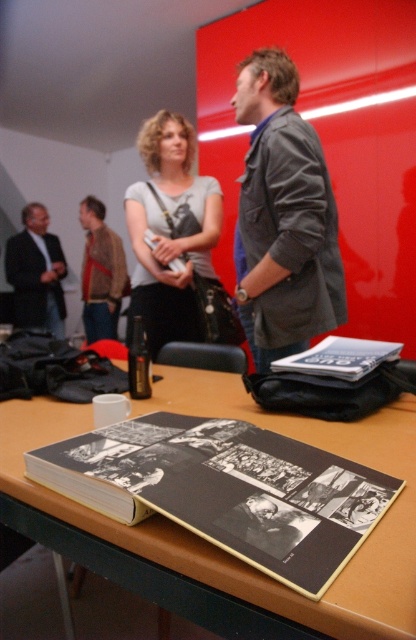
Question: Which point appears farthest from the camera in this image?

Choices:
 (A) (275, 308)
 (B) (401, 413)
 (C) (96, 337)
 (D) (24, 316)

Answer: (C)

Question: Is matte black suit at left positioned before brown leather jacket at left?

Choices:
 (A) no
 (B) yes

Answer: (A)

Question: Can you confirm if matte gray shirt at center is wider than black matte book at center?

Choices:
 (A) no
 (B) yes

Answer: (B)

Question: Estimate the real-world distances between objects in this image. Which object is closer to the brown wooden table at center?

Choices:
 (A) black matte book at center
 (B) dark gray textured jacket at center

Answer: (A)

Question: Where is matte black suit at left located in relation to black matte book at center in the image?

Choices:
 (A) left
 (B) right

Answer: (A)

Question: Which object appears farthest from the camera in this image?

Choices:
 (A) black matte book at center
 (B) brown leather jacket at left
 (C) brown wooden table at center
 (D) matte gray shirt at center

Answer: (B)